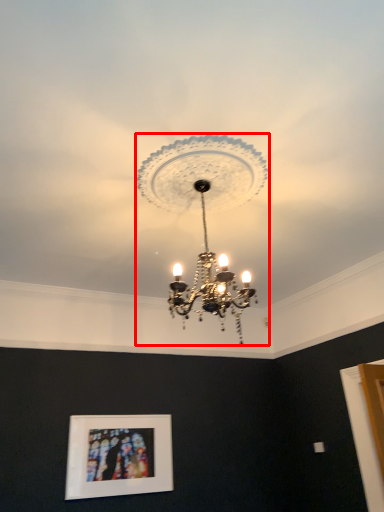
Question: From the image's perspective, where is lamp (annotated by the red box) located relative to picture frame?

Choices:
 (A) below
 (B) above

Answer: (B)